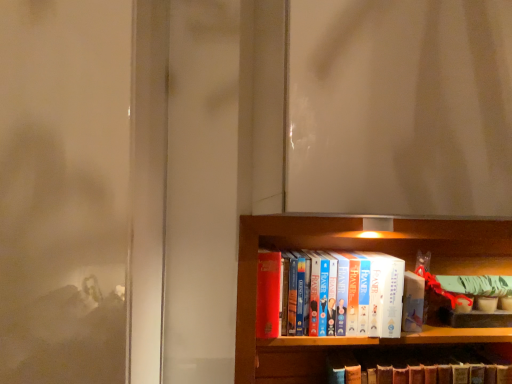
Locate an element on the screen. This screenshot has width=512, height=384. hardcover book at center, acting as the second book starting from the top is located at coordinates (418, 367).

What do you see at coordinates (418, 367) in the screenshot? I see `hardcover book at center, acting as the second book starting from the top` at bounding box center [418, 367].

What do you see at coordinates (358, 296) in the screenshot? This screenshot has height=384, width=512. I see `hardcover book at center, acting as the 2th book starting from the bottom` at bounding box center [358, 296].

Where is `hardcover book at center, acting as the 2th book starting from the bottom`? The width and height of the screenshot is (512, 384). hardcover book at center, acting as the 2th book starting from the bottom is located at coordinates (358, 296).

You are a GUI agent. You are given a task and a screenshot of the screen. Output one action in this format:
    pyautogui.click(x=<x>, y=<y>)
    Task: Click on the hardcover book at center, placed as the first book when sorted from bottom to top
    This screenshot has height=384, width=512.
    Given the screenshot: What is the action you would take?
    [418, 367]

Which object is positioned more to the right, hardcover book at center, acting as the 2th book starting from the bottom, or hardcover book at center, acting as the second book starting from the top?

From the viewer's perspective, hardcover book at center, acting as the second book starting from the top, appears more on the right side.

Is hardcover book at center, acting as the 2th book starting from the bottom, positioned in front of hardcover book at center, placed as the first book when sorted from bottom to top?

Yes, hardcover book at center, acting as the 2th book starting from the bottom, is closer to the viewer.

Which is less distant, (304, 272) or (417, 361)?

Point (304, 272) appears to be closer to the viewer than point (417, 361).

From the image's perspective, is hardcover book at center, positioned as the 1th book in top-to-bottom order, positioned above or below hardcover book at center, placed as the first book when sorted from bottom to top?

From the image's perspective, hardcover book at center, positioned as the 1th book in top-to-bottom order, appears above hardcover book at center, placed as the first book when sorted from bottom to top.

From a real-world perspective, between hardcover book at center, positioned as the 1th book in top-to-bottom order, and hardcover book at center, acting as the second book starting from the top, who is vertically higher?

In real-world perspective, hardcover book at center, positioned as the 1th book in top-to-bottom order, is above.

Between hardcover book at center, positioned as the 1th book in top-to-bottom order, and hardcover book at center, placed as the first book when sorted from bottom to top, which one has smaller width?

With smaller width is hardcover book at center, placed as the first book when sorted from bottom to top.

Considering the relative sizes of hardcover book at center, acting as the 2th book starting from the bottom, and hardcover book at center, placed as the first book when sorted from bottom to top, in the image provided, is hardcover book at center, acting as the 2th book starting from the bottom, shorter than hardcover book at center, placed as the first book when sorted from bottom to top,?

Incorrect, the height of hardcover book at center, acting as the 2th book starting from the bottom, does not fall short of that of hardcover book at center, placed as the first book when sorted from bottom to top.

Which of these two, hardcover book at center, positioned as the 1th book in top-to-bottom order, or hardcover book at center, acting as the second book starting from the top, is bigger?

Bigger between the two is hardcover book at center, positioned as the 1th book in top-to-bottom order.

Choose the correct answer: Is hardcover book at center, positioned as the 1th book in top-to-bottom order, inside hardcover book at center, placed as the first book when sorted from bottom to top, or outside it?

hardcover book at center, positioned as the 1th book in top-to-bottom order, cannot be found inside hardcover book at center, placed as the first book when sorted from bottom to top.

Is there a large distance between hardcover book at center, acting as the 2th book starting from the bottom, and hardcover book at center, placed as the first book when sorted from bottom to top?

Actually, hardcover book at center, acting as the 2th book starting from the bottom, and hardcover book at center, placed as the first book when sorted from bottom to top, are a little close together.

Is hardcover book at center, acting as the 2th book starting from the bottom, positioned with its back to hardcover book at center, placed as the first book when sorted from bottom to top?

No, hardcover book at center, acting as the 2th book starting from the bottom,'s orientation is not away from hardcover book at center, placed as the first book when sorted from bottom to top.

The width and height of the screenshot is (512, 384). Identify the location of book that is on the right side of hardcover book at center, acting as the 2th book starting from the bottom. (418, 367).

Is hardcover book at center, placed as the first book when sorted from bottom to top, at the right side of hardcover book at center, positioned as the 1th book in top-to-bottom order?

Correct, you'll find hardcover book at center, placed as the first book when sorted from bottom to top, to the right of hardcover book at center, positioned as the 1th book in top-to-bottom order.

Which object is closer to the camera taking this photo, hardcover book at center, acting as the second book starting from the top, or hardcover book at center, positioned as the 1th book in top-to-bottom order?

hardcover book at center, positioned as the 1th book in top-to-bottom order, is closer to the camera.

Is point (499, 377) farther from viewer compared to point (362, 325)?

Yes, it is behind point (362, 325).

From the image's perspective, does hardcover book at center, placed as the first book when sorted from bottom to top, appear lower than hardcover book at center, acting as the 2th book starting from the bottom?

Yes, from the image's perspective, hardcover book at center, placed as the first book when sorted from bottom to top, is below hardcover book at center, acting as the 2th book starting from the bottom.

From a real-world perspective, is hardcover book at center, acting as the second book starting from the top, positioned above or below hardcover book at center, acting as the 2th book starting from the bottom?

Clearly, from a real-world perspective, hardcover book at center, acting as the second book starting from the top, is below hardcover book at center, acting as the 2th book starting from the bottom.

Considering the relative sizes of hardcover book at center, placed as the first book when sorted from bottom to top, and hardcover book at center, acting as the 2th book starting from the bottom, in the image provided, is hardcover book at center, placed as the first book when sorted from bottom to top, thinner than hardcover book at center, acting as the 2th book starting from the bottom,?

Correct, the width of hardcover book at center, placed as the first book when sorted from bottom to top, is less than that of hardcover book at center, acting as the 2th book starting from the bottom.

Between hardcover book at center, acting as the second book starting from the top, and hardcover book at center, positioned as the 1th book in top-to-bottom order, which one has less height?

With less height is hardcover book at center, acting as the second book starting from the top.

Does hardcover book at center, placed as the first book when sorted from bottom to top, have a larger size compared to hardcover book at center, positioned as the 1th book in top-to-bottom order?

No.

From the picture: Is hardcover book at center, acting as the second book starting from the top, inside or outside of hardcover book at center, positioned as the 1th book in top-to-bottom order?

hardcover book at center, acting as the second book starting from the top, is outside hardcover book at center, positioned as the 1th book in top-to-bottom order.

Is there a large distance between hardcover book at center, acting as the second book starting from the top, and hardcover book at center, acting as the 2th book starting from the bottom?

No, hardcover book at center, acting as the second book starting from the top, is in close proximity to hardcover book at center, acting as the 2th book starting from the bottom.

Is hardcover book at center, acting as the second book starting from the top, facing towards hardcover book at center, positioned as the 1th book in top-to-bottom order?

No, hardcover book at center, acting as the second book starting from the top, is not aimed at hardcover book at center, positioned as the 1th book in top-to-bottom order.

How different are the orientations of hardcover book at center, placed as the first book when sorted from bottom to top, and hardcover book at center, positioned as the 1th book in top-to-bottom order, in degrees?

They differ by 0.00336 degrees in their facing directions.

The height and width of the screenshot is (384, 512). I want to click on book above the hardcover book at center, acting as the second book starting from the top (from a real-world perspective), so click(x=358, y=296).

The height and width of the screenshot is (384, 512). Identify the location of book below the hardcover book at center, positioned as the 1th book in top-to-bottom order (from the image's perspective). (418, 367).

Locate an element on the screen. book below the hardcover book at center, acting as the 2th book starting from the bottom (from a real-world perspective) is located at coordinates (418, 367).